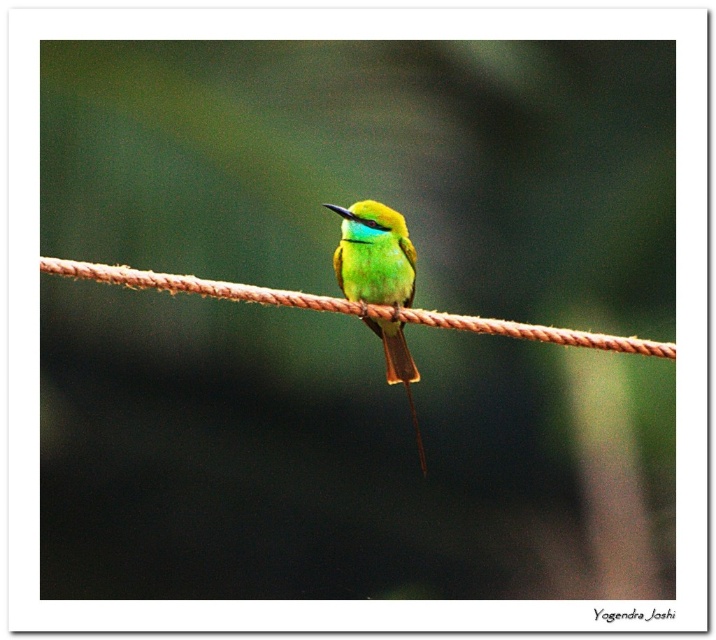
You are a GUI agent. You are given a task and a screenshot of the screen. Output one action in this format:
    pyautogui.click(x=<x>, y=<y>)
    Task: Click on the brown rope at center
    The image size is (716, 640).
    Given the screenshot: What is the action you would take?
    [349, 307]

Is the position of brown rope at center less distant than that of green glossy bird at center?

Yes, brown rope at center is closer to the viewer.

Measure the distance between point (140, 289) and camera.

The distance of point (140, 289) from camera is 2.17 meters.

At what (x,y) coordinates should I click in order to perform the action: click on brown rope at center. Please return your answer as a coordinate pair (x, y). This screenshot has height=640, width=716. Looking at the image, I should click on (349, 307).